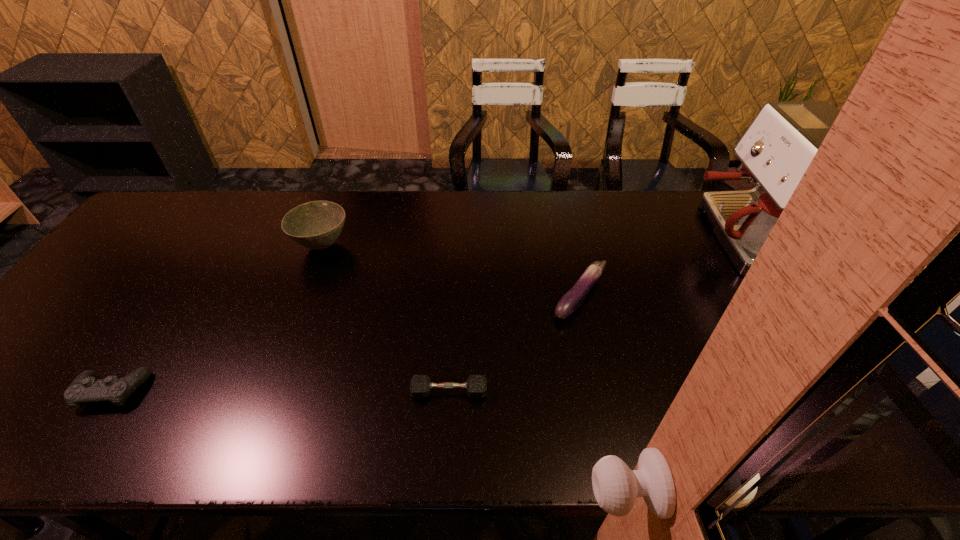
The height and width of the screenshot is (540, 960). What are the coordinates of `vacant space at the far edge of the desktop` in the screenshot? It's located at (433, 207).

This screenshot has width=960, height=540. In the image, there is a desktop. What are the coordinates of `free space at the near edge` in the screenshot? It's located at (126, 448).

In the image, there is a desktop. What are the coordinates of `free space at the left edge` in the screenshot? It's located at (55, 326).

Where is `vacant space at the right edge of the desktop`? This screenshot has width=960, height=540. vacant space at the right edge of the desktop is located at coordinates (906, 327).

This screenshot has height=540, width=960. Identify the location of vacant space at the far left corner of the desktop. (181, 211).

Locate an element on the screen. This screenshot has width=960, height=540. free spot at the far right corner of the desktop is located at coordinates click(802, 220).

The image size is (960, 540). In order to click on vacant space in between the leftmost object and the eggplant in this screenshot , I will do `click(346, 344)`.

Locate an element on the screen. The width and height of the screenshot is (960, 540). empty space that is in between the eggplant and the second object from left to right is located at coordinates (451, 271).

Image resolution: width=960 pixels, height=540 pixels. In order to click on free space that is in between the fourth object from left to right and the tallest object in this screenshot , I will do `click(663, 267)`.

This screenshot has height=540, width=960. Find the location of `free space between the second object from left to right and the dumbbell`. free space between the second object from left to right and the dumbbell is located at coordinates (386, 319).